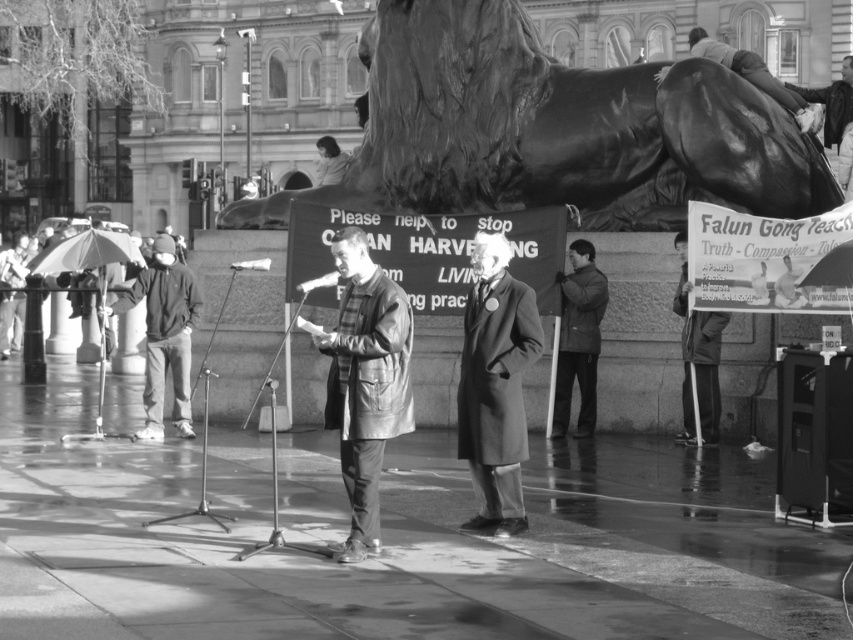
The height and width of the screenshot is (640, 853). Describe the element at coordinates (364, 381) in the screenshot. I see `leather jacket at center` at that location.

Does leather jacket at center have a lesser height compared to smooth bronze statue at upper right?

Indeed, leather jacket at center has a lesser height compared to smooth bronze statue at upper right.

Who is more distant from viewer, (398, 358) or (788, 102)?

Point (788, 102)

Identify the location of leather jacket at center. Image resolution: width=853 pixels, height=640 pixels. (364, 381).

Can you confirm if dark gray hoodie at left is taller than metallic shiny microphone at center?

Yes, dark gray hoodie at left is taller than metallic shiny microphone at center.

Can you confirm if dark gray hoodie at left is wider than metallic shiny microphone at center?

Correct, the width of dark gray hoodie at left exceeds that of metallic shiny microphone at center.

Is point (173, 284) positioned before point (326, 285)?

No, it is behind (326, 285).

Find the location of `dark gray hoodie at left`. dark gray hoodie at left is located at coordinates (164, 333).

What do you see at coordinates (554, 131) in the screenshot?
I see `polished bronze horse at upper center` at bounding box center [554, 131].

Can you confirm if polished bronze horse at upper center is positioned below dark gray hoodie at left?

No, polished bronze horse at upper center is not below dark gray hoodie at left.

This screenshot has height=640, width=853. What do you see at coordinates (554, 131) in the screenshot?
I see `polished bronze horse at upper center` at bounding box center [554, 131].

Locate an element on the screen. The height and width of the screenshot is (640, 853). polished bronze horse at upper center is located at coordinates (554, 131).